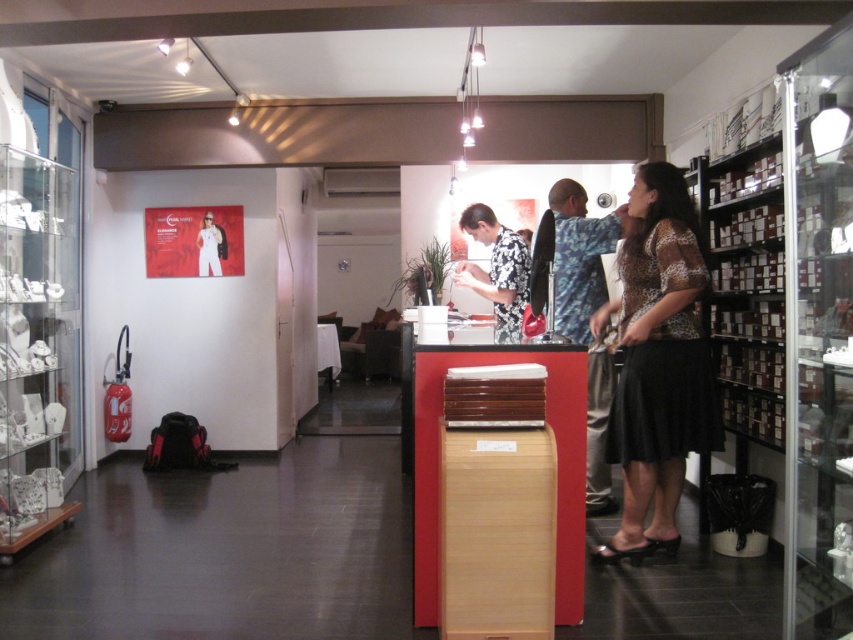
Question: Where is leopard print blouse at center located in relation to black floral shirt at center in the image?

Choices:
 (A) above
 (B) below

Answer: (B)

Question: Which object appears farthest from the camera in this image?

Choices:
 (A) leopard print blouse at center
 (B) black floral shirt at center

Answer: (B)

Question: Is leopard print blouse at center smaller than black floral shirt at center?

Choices:
 (A) no
 (B) yes

Answer: (B)

Question: Which of the following is the closest to the observer?

Choices:
 (A) (642, 285)
 (B) (497, 307)

Answer: (A)

Question: Is the position of leopard print blouse at center more distant than that of black floral shirt at center?

Choices:
 (A) no
 (B) yes

Answer: (A)